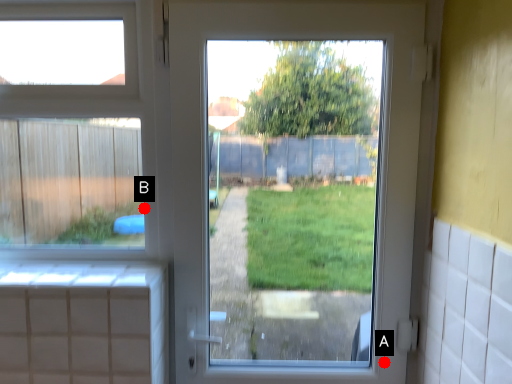
Question: Two points are circled on the image, labeled by A and B beside each circle. Which point is closer to the camera taking this photo?

Choices:
 (A) A is closer
 (B) B is closer

Answer: (B)